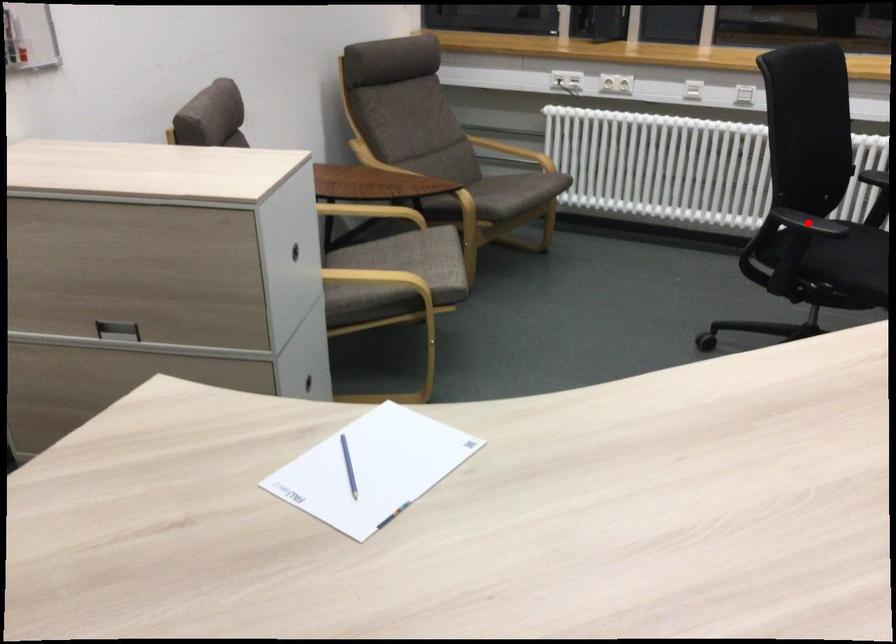
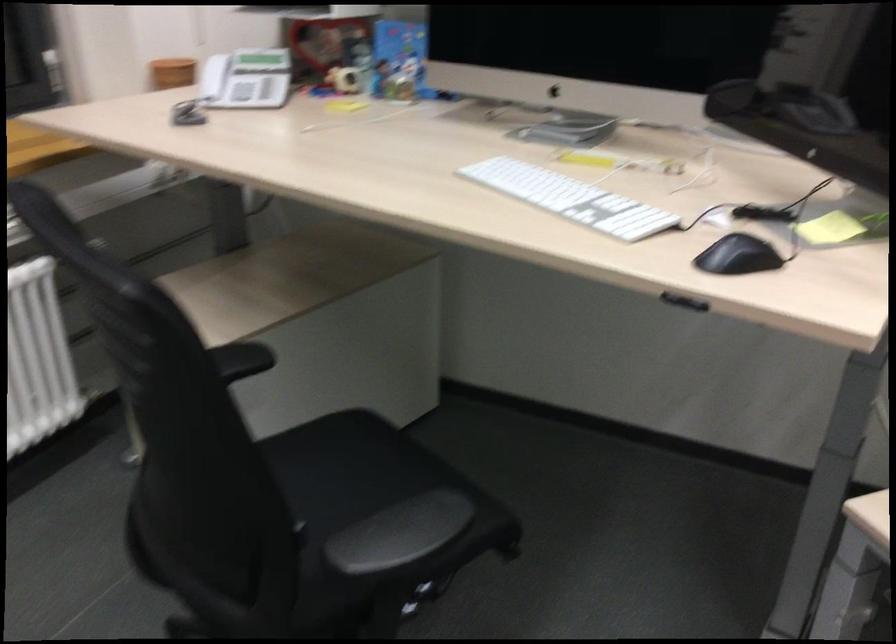
Question: I am providing you with two images of the same scene from different viewpoints. Image1 has a red point marked. In image2, the corresponding 3D location appears at what relative position? Reply with the corresponding letter.

Choices:
 (A) Closer
 (B) Farther

Answer: (A)